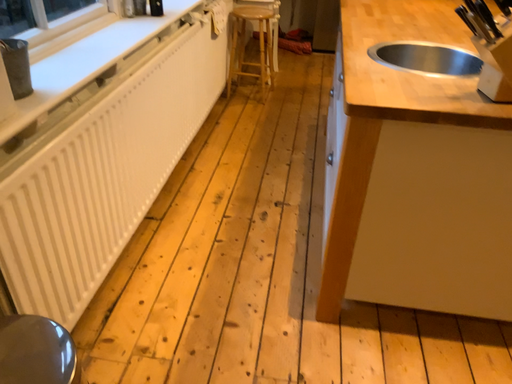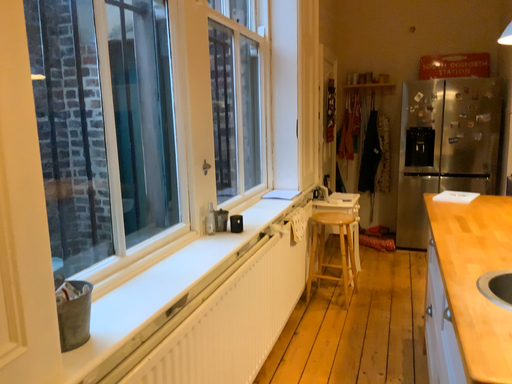
Question: How did the camera likely rotate when shooting the video?

Choices:
 (A) rotated left
 (B) rotated right

Answer: (A)